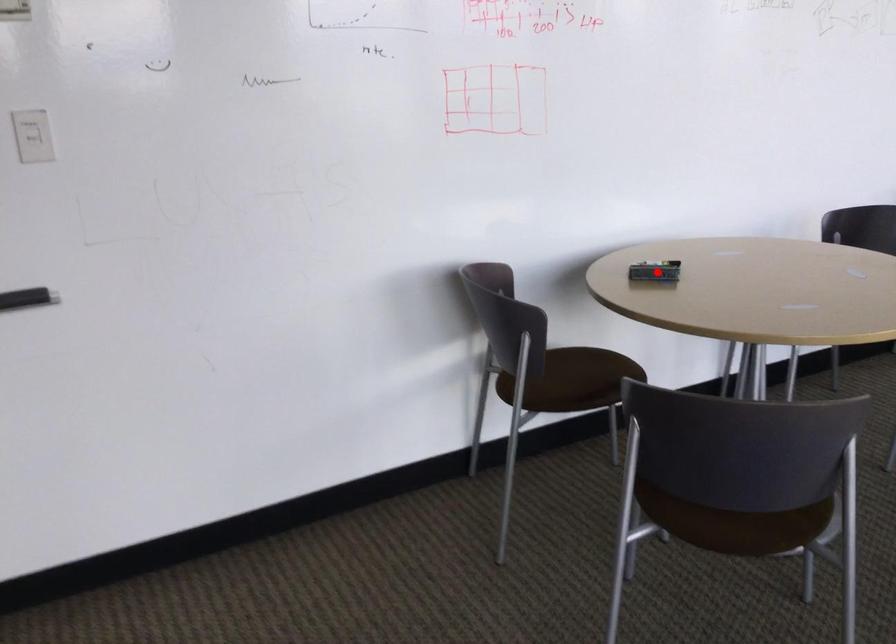
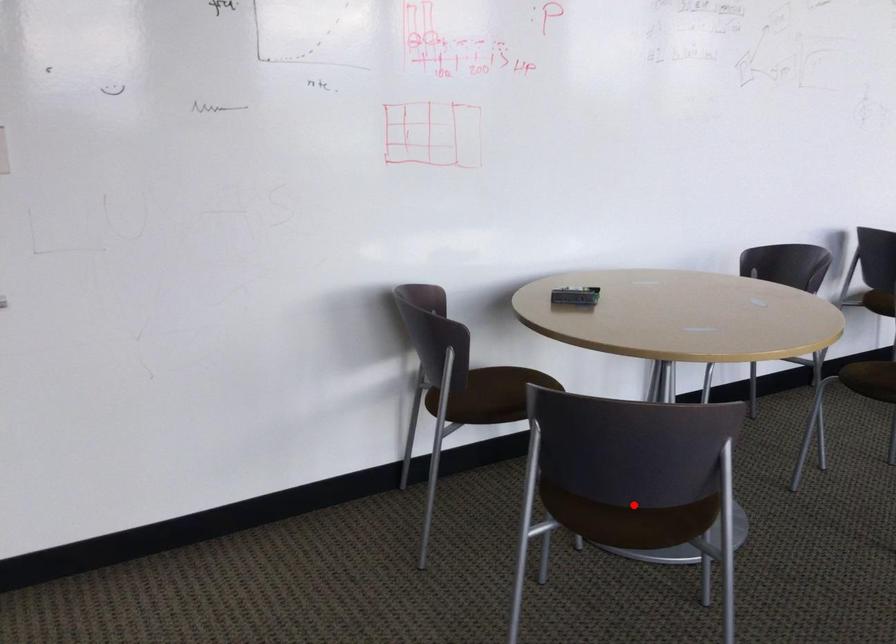
I am providing you with two images of the same scene from different viewpoints. A red point is marked on the first image and another point is marked on the second image. Does the point marked in image1 correspond to the same location as the one in image2?

No